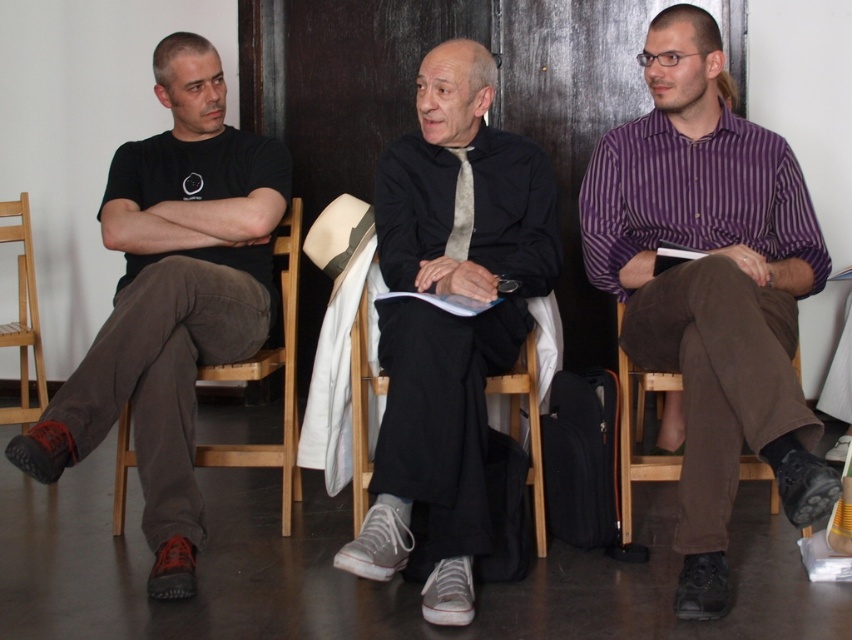
Can you confirm if matte black t-shirt at left is positioned to the left of light brown wooden chair at left?

No, matte black t-shirt at left is not to the left of light brown wooden chair at left.

Which is behind, point (208, 268) or point (26, 385)?

Positioned behind is point (26, 385).

Identify the location of matte black t-shirt at left. coord(171,298).

Is black matte shirt at center wider than light brown wooden chair at left?

Yes.

Is black matte shirt at center thinner than light brown wooden chair at left?

In fact, black matte shirt at center might be wider than light brown wooden chair at left.

Does point (514, 192) come in front of point (19, 417)?

That is True.

Identify the location of black matte shirt at center. The height and width of the screenshot is (640, 852). (448, 323).

Is point (16, 420) more distant than point (471, 170)?

That is True.

Who is positioned more to the left, light brown wooden chair at left or gray textured tie at center?

light brown wooden chair at left

Between point (22, 278) and point (465, 241), which one is positioned behind?

The point (22, 278) is behind.

The height and width of the screenshot is (640, 852). What are the coordinates of `light brown wooden chair at left` in the screenshot? It's located at (22, 317).